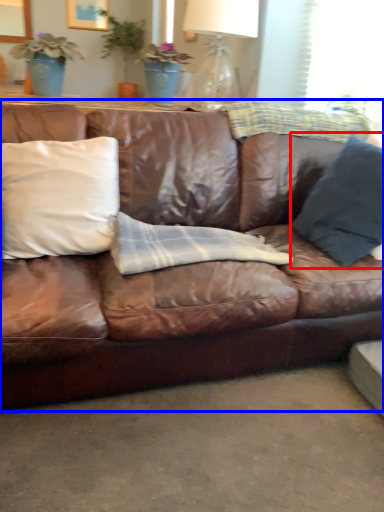
Question: Among these objects, which one is nearest to the camera, pillow (highlighted by a red box) or studio couch (highlighted by a blue box)?

Choices:
 (A) pillow
 (B) studio couch

Answer: (B)